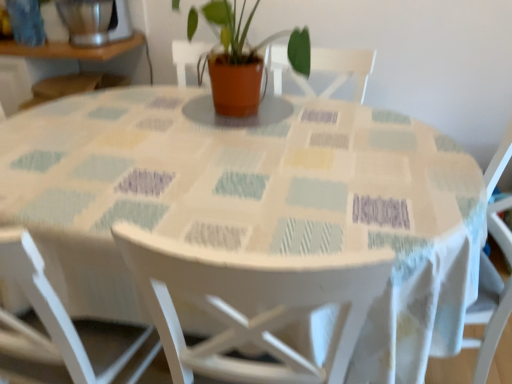
The image size is (512, 384). Describe the element at coordinates (244, 59) in the screenshot. I see `matte terracotta pot at center` at that location.

This screenshot has width=512, height=384. What do you see at coordinates (252, 304) in the screenshot?
I see `white wood chair at center, which ranks as the second chair in left-to-right order` at bounding box center [252, 304].

Identify the location of white wood chair at lower left, the 2th chair from the right. (53, 306).

Identify the location of matte terracotta pot at center. (244, 59).

Based on their positions, is brushed metal blender at upper left located to the left or right of white wood chair at center, the 1th chair when ordered from right to left?

In the image, brushed metal blender at upper left appears on the left side of white wood chair at center, the 1th chair when ordered from right to left.

Which of these two, brushed metal blender at upper left or white wood chair at center, the 1th chair when ordered from right to left, is smaller?

Smaller between the two is brushed metal blender at upper left.

Which object is more forward, brushed metal blender at upper left or white wood chair at center, the 1th chair when ordered from right to left?

white wood chair at center, the 1th chair when ordered from right to left.

Which of these two, white wood chair at center, the 1th chair when ordered from right to left, or matte terracotta pot at center, is bigger?

white wood chair at center, the 1th chair when ordered from right to left.

From a real-world perspective, which is physically below, white wood chair at center, the 1th chair when ordered from right to left, or matte terracotta pot at center?

In real-world perspective, white wood chair at center, the 1th chair when ordered from right to left, is lower.

From the image's perspective, is white wood chair at center, the 1th chair when ordered from right to left, located beneath matte terracotta pot at center?

Yes, from the image's perspective, white wood chair at center, the 1th chair when ordered from right to left, is below matte terracotta pot at center.

Considering the sizes of objects white wood chair at center, the 1th chair when ordered from right to left, and matte terracotta pot at center in the image provided, who is shorter, white wood chair at center, the 1th chair when ordered from right to left, or matte terracotta pot at center?

Standing shorter between the two is matte terracotta pot at center.

Who is shorter, white wood chair at lower left, arranged as the 1th chair when viewed from the left, or brushed metal blender at upper left?

brushed metal blender at upper left is shorter.

Does white wood chair at lower left, the 2th chair from the right, have a smaller size compared to brushed metal blender at upper left?

No, white wood chair at lower left, the 2th chair from the right, is not smaller than brushed metal blender at upper left.

Is white wood chair at lower left, the 2th chair from the right, wider than brushed metal blender at upper left?

Yes.

Considering the positions of points (45, 311) and (109, 2), is point (45, 311) farther from camera compared to point (109, 2)?

No, it is in front of (109, 2).

From a real-world perspective, is matte terracotta pot at center located higher than white wood chair at center, the 1th chair when ordered from right to left?

Yes, from a real-world perspective, matte terracotta pot at center is on top of white wood chair at center, the 1th chair when ordered from right to left.

Does point (258, 101) appear closer or farther from the camera than point (306, 311)?

Point (258, 101) is positioned farther from the camera compared to point (306, 311).

From the image's perspective, who appears lower, matte terracotta pot at center or white wood chair at center, which ranks as the second chair in left-to-right order?

white wood chair at center, which ranks as the second chair in left-to-right order, from the image's perspective.

Is brushed metal blender at upper left beside matte terracotta pot at center?

brushed metal blender at upper left is not next to matte terracotta pot at center, and they're not touching.

Looking at their sizes, would you say brushed metal blender at upper left is wider or thinner than matte terracotta pot at center?

brushed metal blender at upper left is thinner than matte terracotta pot at center.

Is brushed metal blender at upper left turned away from matte terracotta pot at center?

That's not correct — brushed metal blender at upper left is not looking away from matte terracotta pot at center.

Does brushed metal blender at upper left have a larger size compared to matte terracotta pot at center?

Incorrect, brushed metal blender at upper left is not larger than matte terracotta pot at center.

Which is in front, point (384, 261) or point (52, 318)?

The point (384, 261) is closer to the camera.

Is white wood chair at center, which ranks as the second chair in left-to-right order, wider or thinner than white wood chair at lower left, arranged as the 1th chair when viewed from the left?

In the image, white wood chair at center, which ranks as the second chair in left-to-right order, appears to be wider than white wood chair at lower left, arranged as the 1th chair when viewed from the left.

Consider the image. Considering the relative positions of white wood chair at center, the 1th chair when ordered from right to left, and white wood chair at lower left, arranged as the 1th chair when viewed from the left, in the image provided, is white wood chair at center, the 1th chair when ordered from right to left, in front of white wood chair at lower left, arranged as the 1th chair when viewed from the left,?

That is True.

What's the angular difference between brushed metal blender at upper left and white wood chair at lower left, the 2th chair from the right,'s facing directions?

The facing directions of brushed metal blender at upper left and white wood chair at lower left, the 2th chair from the right, are 179 degrees apart.

Is brushed metal blender at upper left oriented away from white wood chair at lower left, arranged as the 1th chair when viewed from the left?

No, brushed metal blender at upper left is not facing away from white wood chair at lower left, arranged as the 1th chair when viewed from the left.

From a real-world perspective, is brushed metal blender at upper left above or below white wood chair at lower left, the 2th chair from the right?

From a real-world perspective, brushed metal blender at upper left is physically above white wood chair at lower left, the 2th chair from the right.

Which is less distant, (88, 20) or (35, 253)?

Point (88, 20).

Where is `chair that is the 2nd one when counting downward from the brushed metal blender at upper left (from the image's perspective)`? The image size is (512, 384). chair that is the 2nd one when counting downward from the brushed metal blender at upper left (from the image's perspective) is located at coordinates (252, 304).

The height and width of the screenshot is (384, 512). I want to click on houseplant located above the white wood chair at center, the 1th chair when ordered from right to left (from a real-world perspective), so click(x=244, y=59).

Estimate the real-world distances between objects in this image. Which object is closer to white wood chair at lower left, arranged as the 1th chair when viewed from the left, matte terracotta pot at center or brushed metal blender at upper left?

matte terracotta pot at center is closer to white wood chair at lower left, arranged as the 1th chair when viewed from the left.

Looking at the image, which one is located closer to matte terracotta pot at center, brushed metal blender at upper left or white wood chair at lower left, the 2th chair from the right?

Among the two, brushed metal blender at upper left is located nearer to matte terracotta pot at center.

Looking at this image, looking at the image, which one is located further to brushed metal blender at upper left, white wood chair at center, which ranks as the second chair in left-to-right order, or white wood chair at lower left, the 2th chair from the right?

Based on the image, white wood chair at center, which ranks as the second chair in left-to-right order, appears to be further to brushed metal blender at upper left.

Estimate the real-world distances between objects in this image. Which object is further from brushed metal blender at upper left, matte terracotta pot at center or white wood chair at center, the 1th chair when ordered from right to left?

The object further to brushed metal blender at upper left is white wood chair at center, the 1th chair when ordered from right to left.

In the scene shown: Considering their positions, is matte terracotta pot at center positioned further to white wood chair at center, which ranks as the second chair in left-to-right order, than brushed metal blender at upper left?

brushed metal blender at upper left.

From the picture: Based on their spatial positions, is white wood chair at lower left, the 2th chair from the right, or matte terracotta pot at center further from brushed metal blender at upper left?

white wood chair at lower left, the 2th chair from the right.

Which object lies nearer to the anchor point brushed metal blender at upper left, white wood chair at lower left, the 2th chair from the right, or white wood chair at center, which ranks as the second chair in left-to-right order?

Based on the image, white wood chair at lower left, the 2th chair from the right, appears to be nearer to brushed metal blender at upper left.

When comparing their distances from white wood chair at lower left, the 2th chair from the right, does white wood chair at center, which ranks as the second chair in left-to-right order, or matte terracotta pot at center seem closer?

Based on the image, white wood chair at center, which ranks as the second chair in left-to-right order, appears to be nearer to white wood chair at lower left, the 2th chair from the right.

Locate an element on the screen. The height and width of the screenshot is (384, 512). chair that lies between matte terracotta pot at center and white wood chair at center, which ranks as the second chair in left-to-right order, from top to bottom is located at coordinates (53, 306).

Where is `houseplant between white wood chair at lower left, the 2th chair from the right, and brushed metal blender at upper left, along the z-axis`? The height and width of the screenshot is (384, 512). houseplant between white wood chair at lower left, the 2th chair from the right, and brushed metal blender at upper left, along the z-axis is located at coordinates [x=244, y=59].

Identify the location of chair between white wood chair at center, the 1th chair when ordered from right to left, and brushed metal blender at upper left in the front-back direction. The width and height of the screenshot is (512, 384). (53, 306).

Find the location of a particular element. The height and width of the screenshot is (384, 512). houseplant located between white wood chair at center, which ranks as the second chair in left-to-right order, and brushed metal blender at upper left in the depth direction is located at coordinates (244, 59).